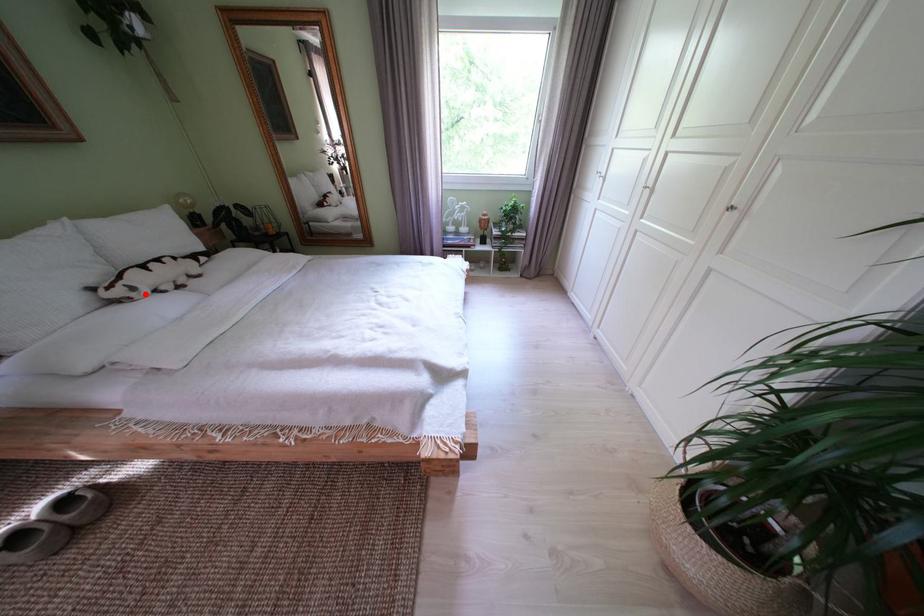
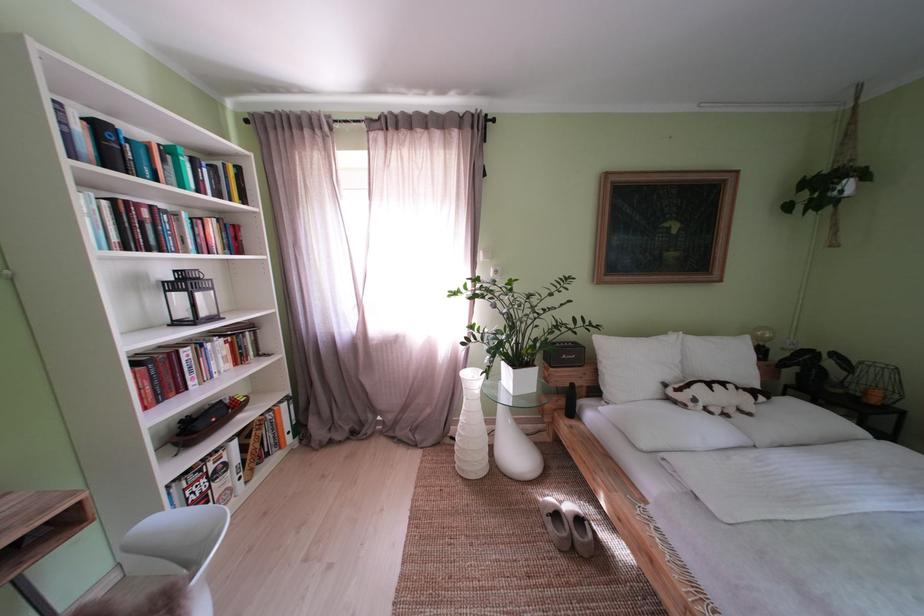
Where in the second image is the point corresponding to the highlighted location from the first image?

(706, 406)